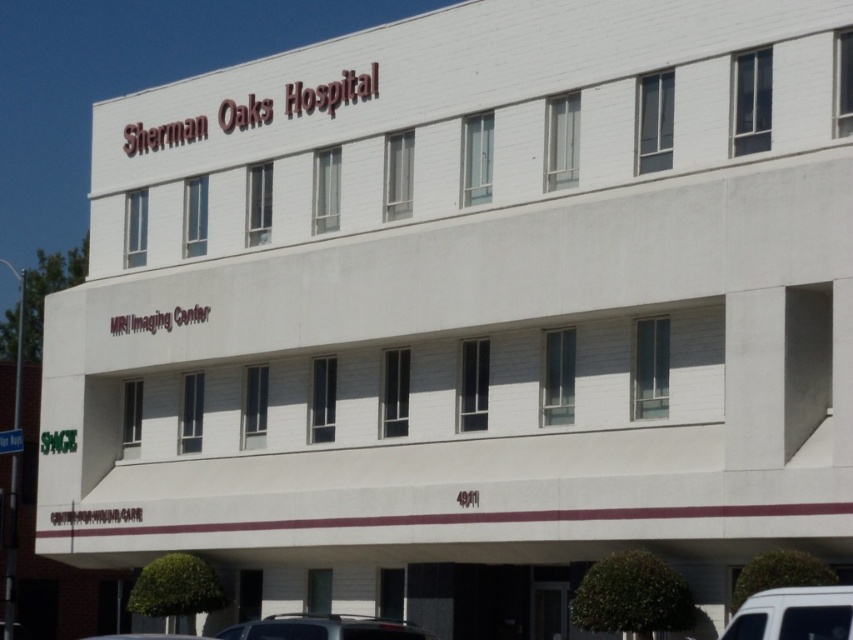
You are a delivery driver arriving at Sherman Oaks Hospital. You need to park your vehicle between the white matte van at lower right and the white matte car at lower center. Since both are parked along the curb, which vehicle should you park behind to ensure you can exit without moving the taller vehicle?

You should park behind the white matte van at lower right because it has a lesser height compared to the white matte car at lower center, meaning the car is taller. By parking behind the shorter van, you can exit without needing to move the taller car.